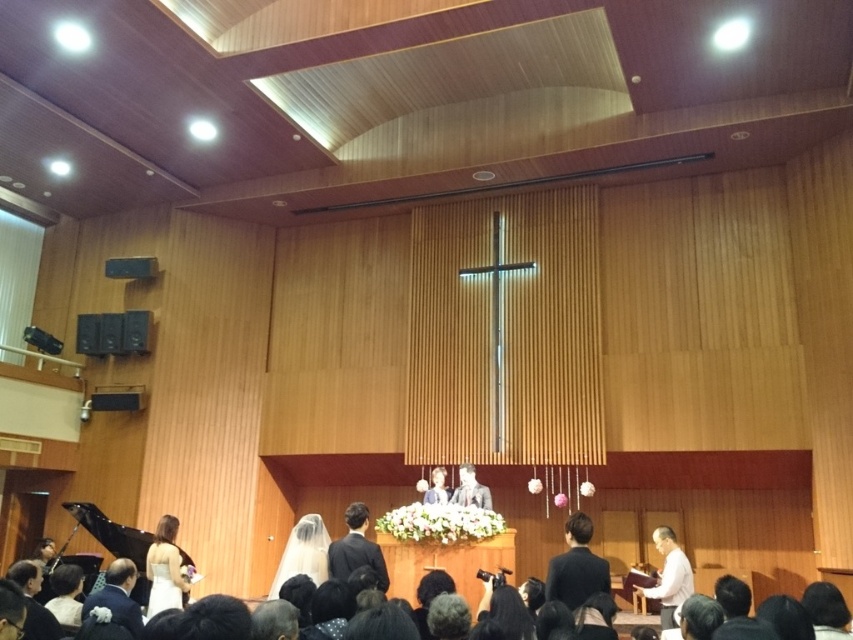
Question: Which point is closer to the camera?

Choices:
 (A) dark blue suit at center
 (B) white satin veil at lower left
 (C) white satin dress at lower left
 (D) light beige fabric dress at center

Answer: (A)

Question: Considering the real-world distances, which object is farthest from the smooth white dress at center?

Choices:
 (A) white satin veil at lower left
 (B) white paper at center

Answer: (B)

Question: Which point is farther from the camera taking this photo?

Choices:
 (A) (582, 528)
 (B) (170, 580)
 (C) (292, 557)
 (D) (440, 472)

Answer: (D)

Question: Considering the relative positions of white paper at center and light beige fabric dress at center in the image provided, where is white paper at center located with respect to light beige fabric dress at center?

Choices:
 (A) right
 (B) left

Answer: (A)

Question: Is smooth white dress at center further to camera compared to light beige fabric dress at center?

Choices:
 (A) yes
 (B) no

Answer: (A)

Question: Can you confirm if white satin dress at lower left is wider than smooth white dress at center?

Choices:
 (A) yes
 (B) no

Answer: (B)